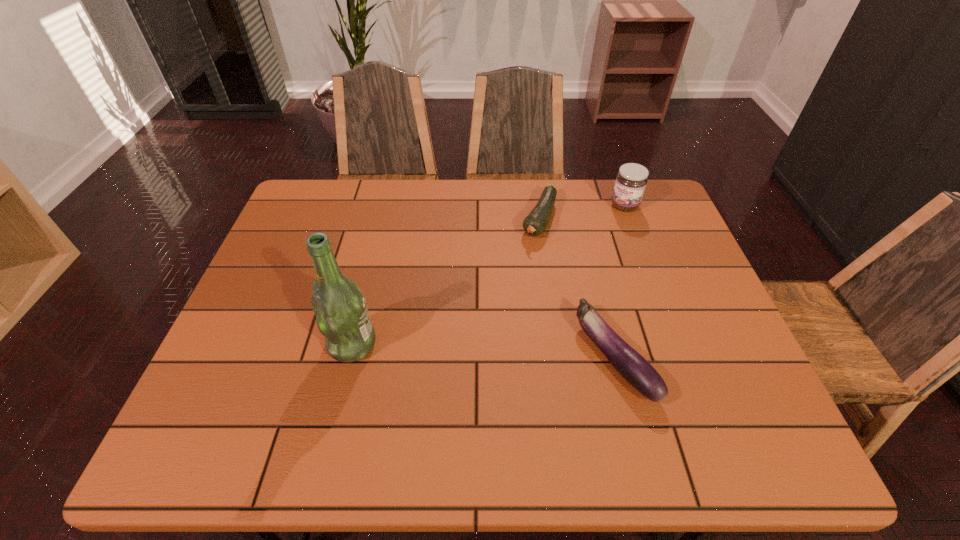
Where is `object that is at the far right corner`? Image resolution: width=960 pixels, height=540 pixels. object that is at the far right corner is located at coordinates (631, 180).

The width and height of the screenshot is (960, 540). In order to click on vacant position at the far edge of the desktop in this screenshot , I will do `click(487, 194)`.

Identify the location of vacant space at the near edge of the desktop. (581, 409).

In order to click on free space at the left edge of the desktop in this screenshot , I will do click(261, 301).

I want to click on free space at the right edge of the desktop, so click(x=663, y=268).

In the image, there is a desktop. Where is `free space at the far left corner`? free space at the far left corner is located at coordinates (319, 183).

Locate an element on the screen. The image size is (960, 540). vacant space at the far right corner of the desktop is located at coordinates (607, 181).

Find the location of a particular element. This screenshot has height=540, width=960. empty space between the rightmost object and the zucchini is located at coordinates (582, 212).

Find the location of `free spot between the second tallest object and the zucchini`. free spot between the second tallest object and the zucchini is located at coordinates (582, 212).

This screenshot has height=540, width=960. Identify the location of vacant area that lies between the beer bottle and the jam. (489, 275).